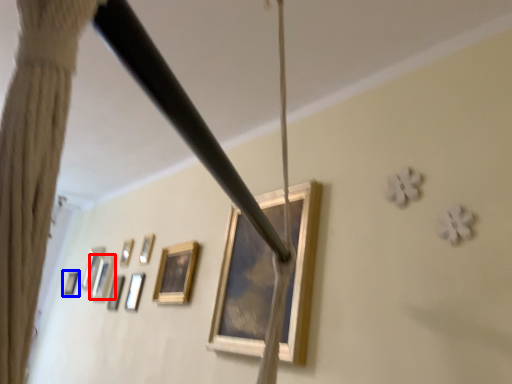
Question: Which of the following is the closest to the observer, picture frame (highlighted by a red box) or picture frame (highlighted by a blue box)?

Choices:
 (A) picture frame
 (B) picture frame

Answer: (A)